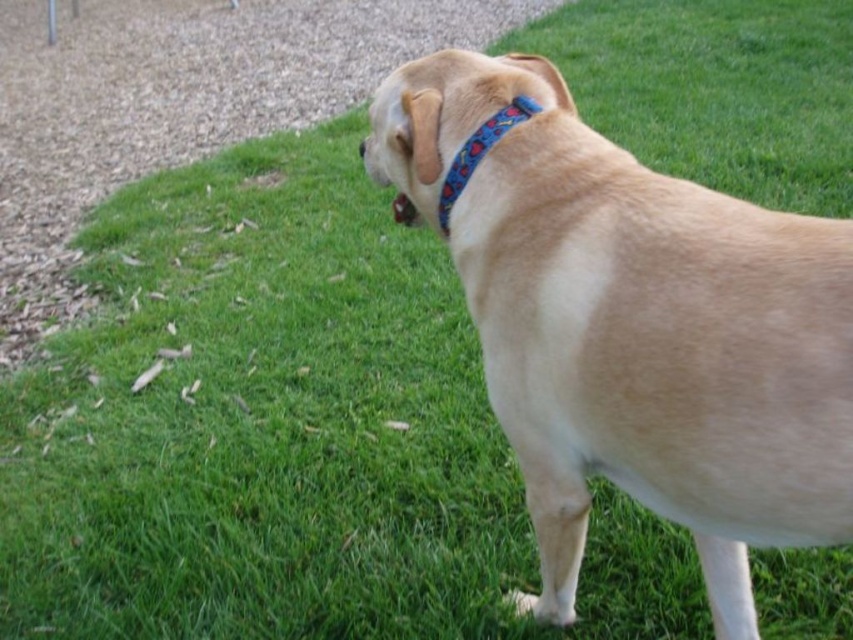
Who is lower down, light brown fur at center or blue fabric neckband at upper center?

light brown fur at center

Image resolution: width=853 pixels, height=640 pixels. In order to click on light brown fur at center in this screenshot , I will do `click(633, 326)`.

In order to click on light brown fur at center in this screenshot , I will do 633,326.